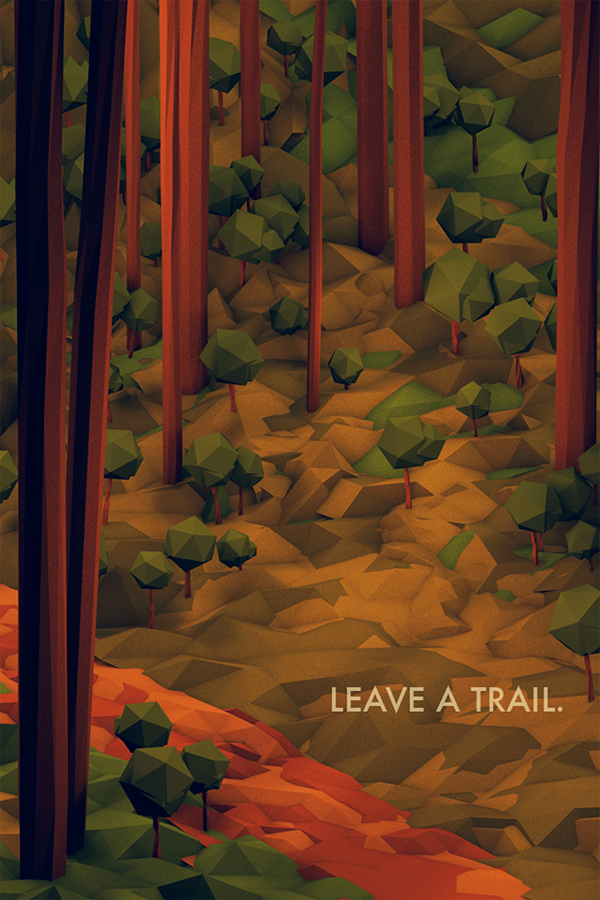
At what (x,y) coordinates should I click in order to perform the action: click on inner corner at the top left. Please return your answer as a coordinate pair (x, y). The height and width of the screenshot is (900, 600). Looking at the image, I should click on (15, 13).